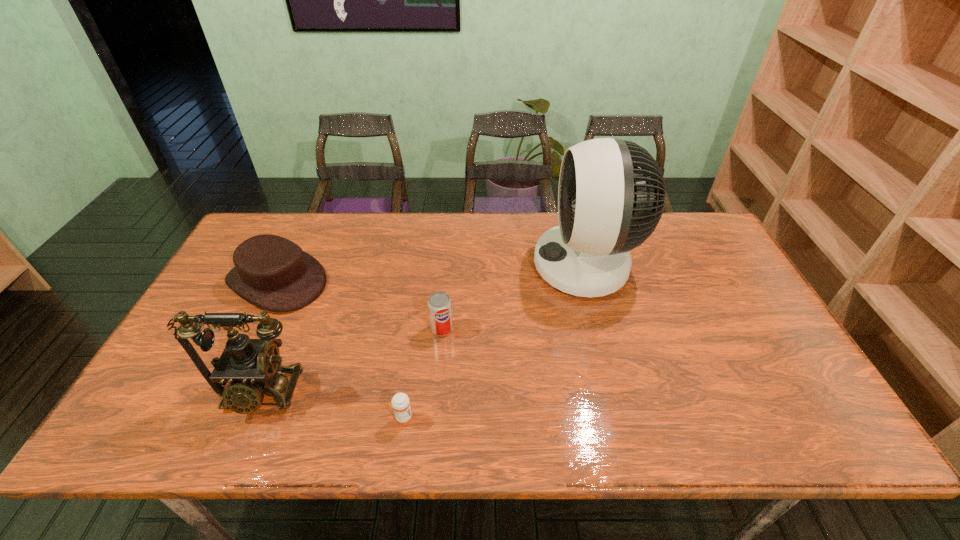
Identify the location of the tallest object. This screenshot has height=540, width=960. (611, 195).

Locate an element on the screen. fan is located at coordinates (611, 195).

Identify the location of the second tallest object. (252, 367).

You are a GUI agent. You are given a task and a screenshot of the screen. Output one action in this format:
    pyautogui.click(x=<x>, y=<y>)
    Task: Click on the hat
    Image resolution: width=960 pixels, height=540 pixels.
    Given the screenshot: What is the action you would take?
    pyautogui.click(x=272, y=272)

Find the location of a particular element. The width and height of the screenshot is (960, 540). the fourth object from left to right is located at coordinates (439, 304).

Where is `the third nearest object`? The height and width of the screenshot is (540, 960). the third nearest object is located at coordinates (439, 304).

Where is `medicine`? medicine is located at coordinates (400, 403).

This screenshot has height=540, width=960. Identify the location of the third object from right to left. (400, 403).

What are the coordinates of `vacant space situated on the grille of the tallest object` in the screenshot? It's located at (404, 266).

Where is `free point located 0.290m on the grille of the tallest object`? The image size is (960, 540). free point located 0.290m on the grille of the tallest object is located at coordinates (440, 266).